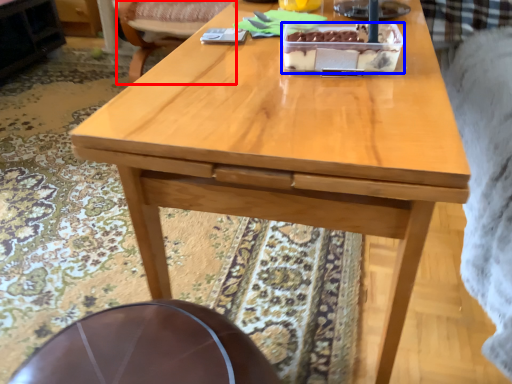
Question: Among these objects, which one is nearest to the camera, chair (highlighted by a red box) or cake (highlighted by a blue box)?

Choices:
 (A) chair
 (B) cake

Answer: (B)